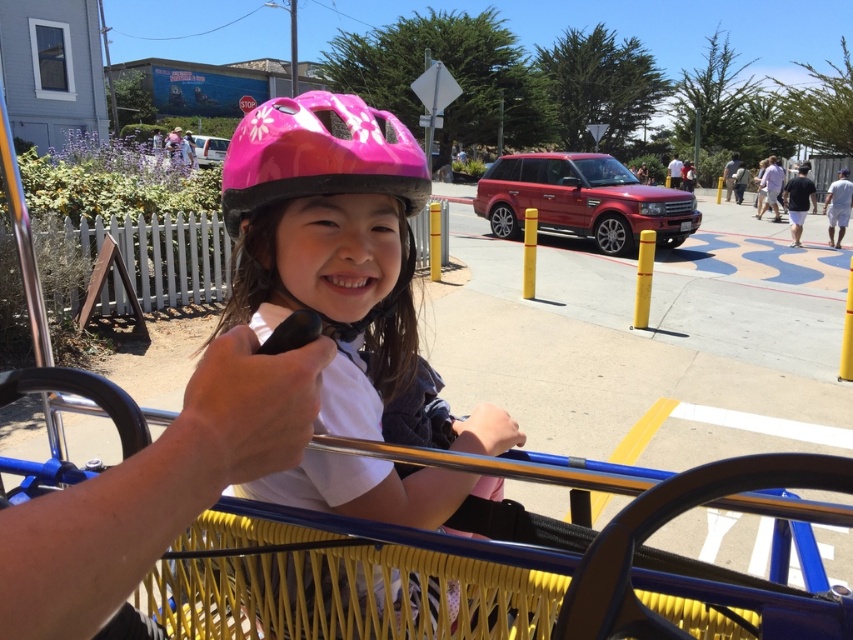
Question: Which point is farther from the camera taking this photo?

Choices:
 (A) (335, 163)
 (B) (772, 589)

Answer: (A)

Question: Is yellow woven basket at center below pink glossy bicycle helmet at center?

Choices:
 (A) yes
 (B) no

Answer: (A)

Question: Where is pink matte helmet at center located in relation to yellow woven basket at center in the image?

Choices:
 (A) above
 (B) below

Answer: (A)

Question: Which point is farther from the camera taking this photo?

Choices:
 (A) (374, 157)
 (B) (378, 310)

Answer: (B)

Question: Which point is closer to the camera?

Choices:
 (A) pink glossy bicycle helmet at center
 (B) yellow woven basket at center

Answer: (B)

Question: Can you confirm if pink matte helmet at center is smaller than pink glossy bicycle helmet at center?

Choices:
 (A) no
 (B) yes

Answer: (A)